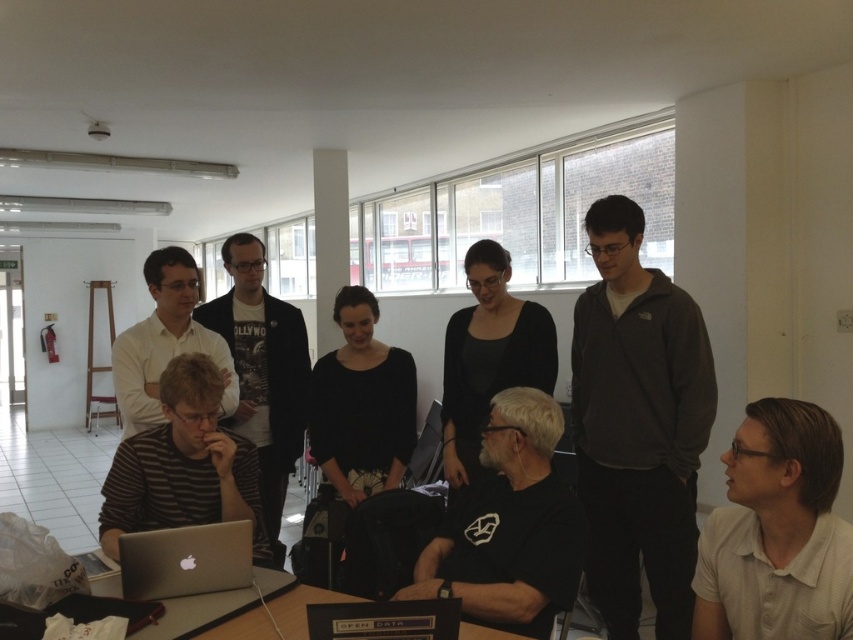
Based on the scene description, where is the striped cotton shirt at center positioned in relation to the room?

The striped cotton shirt at center is located at point 0.577 on the x axis and 0.308 on the y axis.

You are a photographer setting up for a group photo. You notice the striped fabric shirt at left and the black matte shirt at center in the scene. Which shirt should you adjust the lighting to highlight more, considering their sizes?

The striped fabric shirt at left is wider than the black matte shirt at center, so you should adjust the lighting to highlight the striped fabric shirt at left more to account for its larger size.